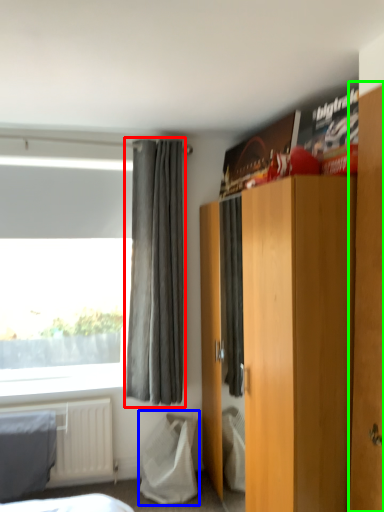
Question: Which object is positioned farthest from curtain (highlighted by a red box)? Select from sheet (highlighted by a blue box) and armoire (highlighted by a green box).

Choices:
 (A) sheet
 (B) armoire

Answer: (B)